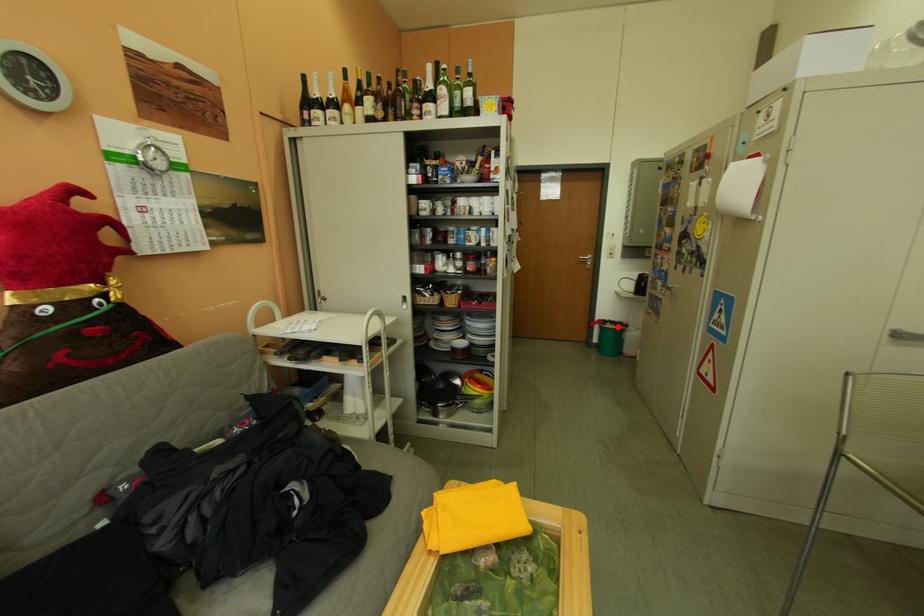
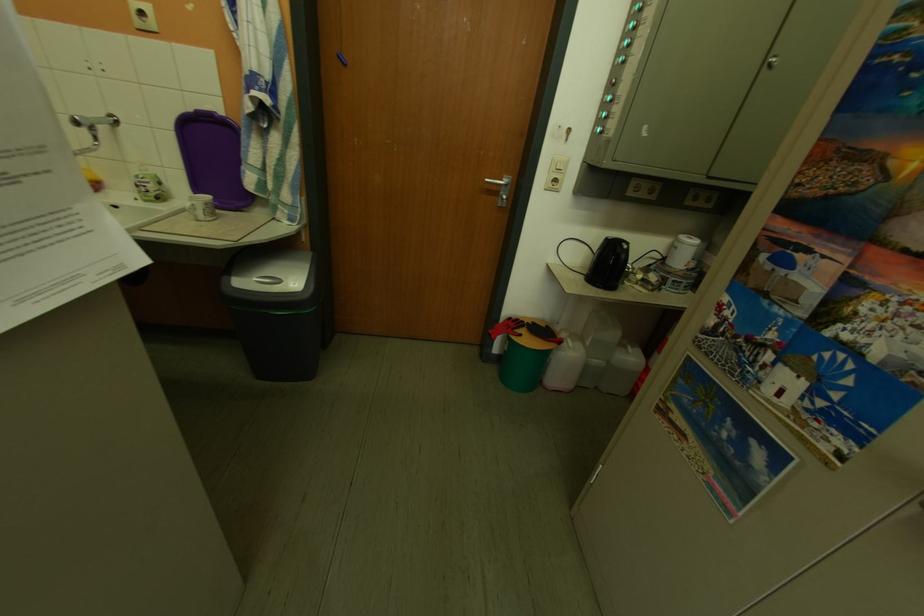
Question: I am providing you with two images of the same scene from different viewpoints. Given a red point in image1, look at the same physical point in image2. Is it:

Choices:
 (A) Closer to the viewpoint
 (B) Farther from the viewpoint

Answer: (B)